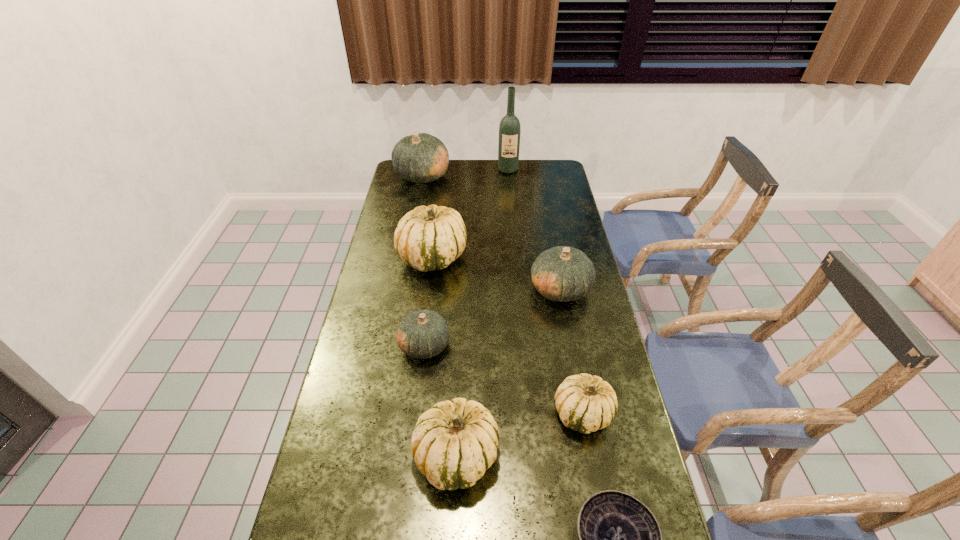
The image size is (960, 540). I want to click on wine bottle, so click(509, 129).

Find the location of a particular element. green wine bottle is located at coordinates (509, 129).

You are a GUI agent. You are given a task and a screenshot of the screen. Output one action in this format:
    pyautogui.click(x=<x>, y=<y>)
    Task: Click on the farthest gourd
    The width and height of the screenshot is (960, 540).
    Given the screenshot: What is the action you would take?
    pyautogui.click(x=419, y=158)

Identify the location of the farthest orange gourd. Image resolution: width=960 pixels, height=540 pixels. (419, 158).

Where is `the farthest white gourd`? Image resolution: width=960 pixels, height=540 pixels. the farthest white gourd is located at coordinates (430, 238).

Locate an element on the screen. This screenshot has width=960, height=540. the second smallest orange gourd is located at coordinates (562, 273).

Where is `the second farthest orange gourd`? The width and height of the screenshot is (960, 540). the second farthest orange gourd is located at coordinates (562, 273).

This screenshot has height=540, width=960. In order to click on the second biggest white gourd in this screenshot , I will do `click(454, 442)`.

You are a GUI agent. You are given a task and a screenshot of the screen. Output one action in this format:
    pyautogui.click(x=<x>, y=<y>)
    Task: Click on the smallest orange gourd
    
    Given the screenshot: What is the action you would take?
    pyautogui.click(x=423, y=334)

Where is `the nearest orange gourd`? Image resolution: width=960 pixels, height=540 pixels. the nearest orange gourd is located at coordinates (423, 334).